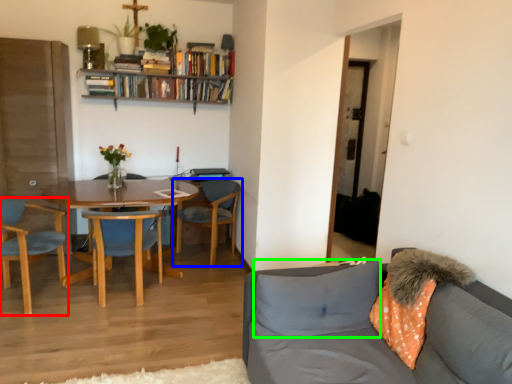
Question: Estimate the real-world distances between objects in this image. Which object is closer to chair (highlighted by a red box), chair (highlighted by a blue box) or pillow (highlighted by a green box)?

Choices:
 (A) chair
 (B) pillow

Answer: (A)